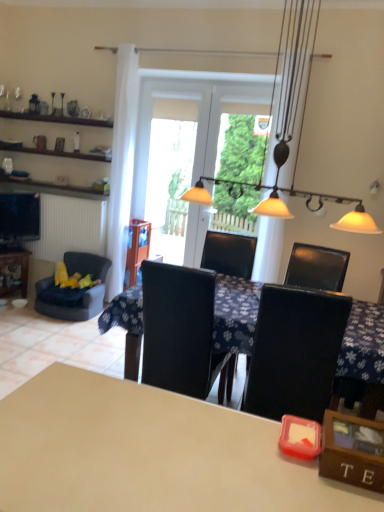
Question: Is velvet blue armchair at left with white sheer curtain at left?

Choices:
 (A) no
 (B) yes

Answer: (A)

Question: From the image's perspective, is velvet blue armchair at left located above white sheer curtain at left?

Choices:
 (A) yes
 (B) no

Answer: (B)

Question: Is velvet blue armchair at left far away from white sheer curtain at left?

Choices:
 (A) yes
 (B) no

Answer: (B)

Question: Is velvet blue armchair at left positioned in front of white sheer curtain at left?

Choices:
 (A) no
 (B) yes

Answer: (B)

Question: From the image's perspective, is velvet blue armchair at left under white sheer curtain at left?

Choices:
 (A) yes
 (B) no

Answer: (A)

Question: From a real-world perspective, is velvet blue armchair at left positioned under white sheer curtain at left based on gravity?

Choices:
 (A) no
 (B) yes

Answer: (B)

Question: Is velvet blue armchair at left far away from beige matte table at center, which is the first table in front-to-back order?

Choices:
 (A) yes
 (B) no

Answer: (A)

Question: From a real-world perspective, is velvet blue armchair at left on top of beige matte table at center, acting as the 2th table starting from the left?

Choices:
 (A) no
 (B) yes

Answer: (A)

Question: Does velvet blue armchair at left appear on the right side of beige matte table at center, acting as the second table starting from the right?

Choices:
 (A) no
 (B) yes

Answer: (A)

Question: From a real-world perspective, is velvet blue armchair at left positioned under beige matte table at center, acting as the 2th table starting from the left, based on gravity?

Choices:
 (A) yes
 (B) no

Answer: (A)

Question: From the image's perspective, is velvet blue armchair at left located beneath beige matte table at center, acting as the 2th table starting from the left?

Choices:
 (A) yes
 (B) no

Answer: (B)

Question: Can you confirm if velvet blue armchair at left is thinner than beige matte table at center, acting as the second table starting from the right?

Choices:
 (A) yes
 (B) no

Answer: (A)

Question: Is beige matte table at center, acting as the 2th table starting from the left, thinner than metallic pendant lights at center?

Choices:
 (A) no
 (B) yes

Answer: (A)